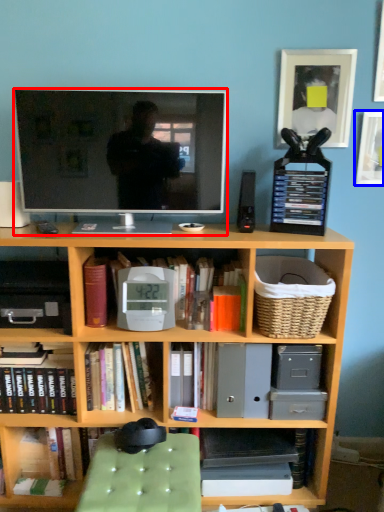
Question: Which point is closer to the camera, television (highlighted by a red box) or picture frame (highlighted by a blue box)?

Choices:
 (A) television
 (B) picture frame

Answer: (A)